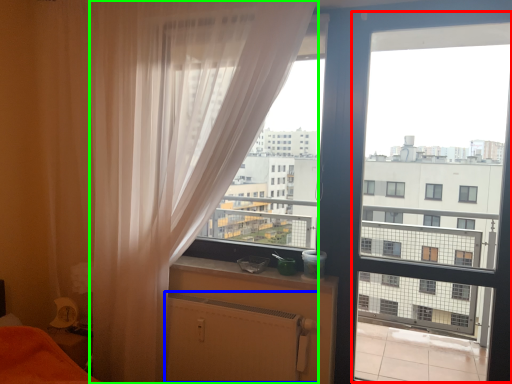
Question: Considering the real-world distances, which object is farthest from screen door (highlighted by a red box)? radiator (highlighted by a blue box) or curtain (highlighted by a green box)?

Choices:
 (A) radiator
 (B) curtain

Answer: (B)